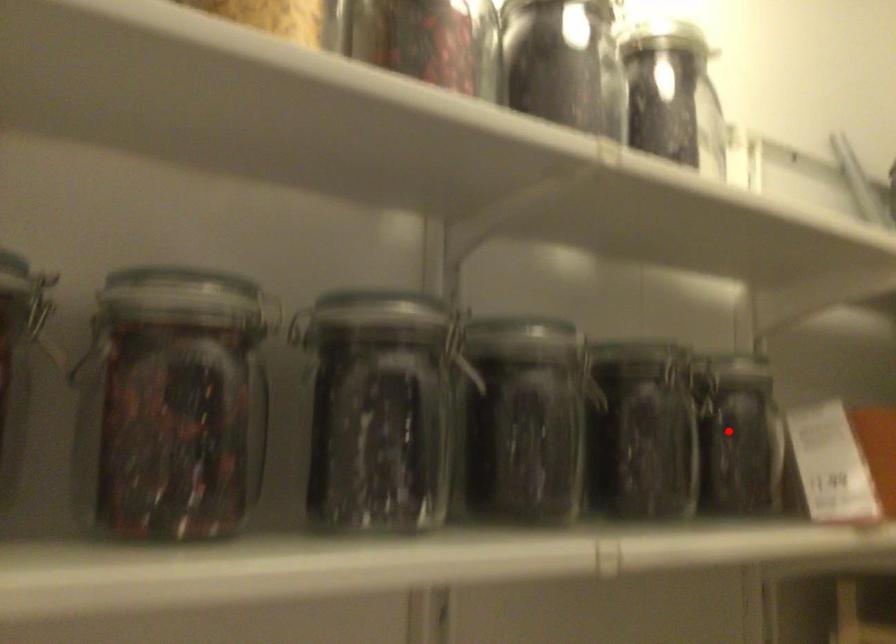
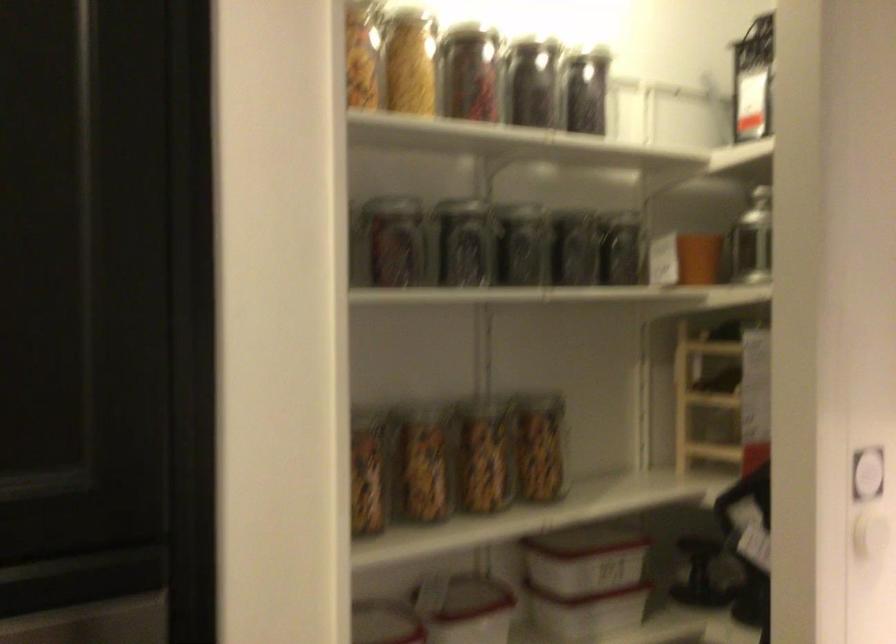
Question: I am providing you with two images of the same scene from different viewpoints. A red point is shown in image1. For the corresponding object point in image2, is it positioned nearer or farther from the camera?

Choices:
 (A) Nearer
 (B) Farther

Answer: (B)